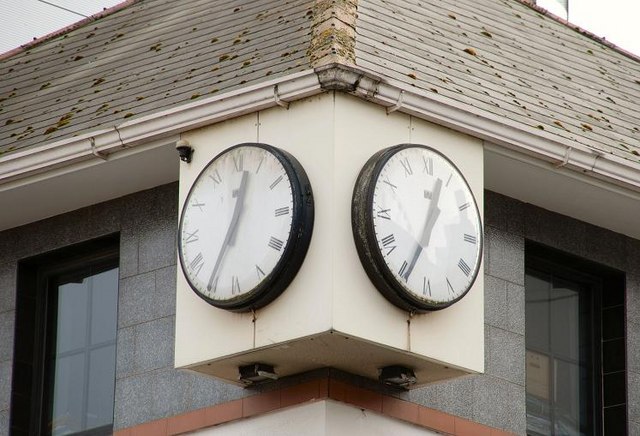
Locate an element on the screen. The width and height of the screenshot is (640, 436). paper hanging in the window on the right is located at coordinates (534, 382).